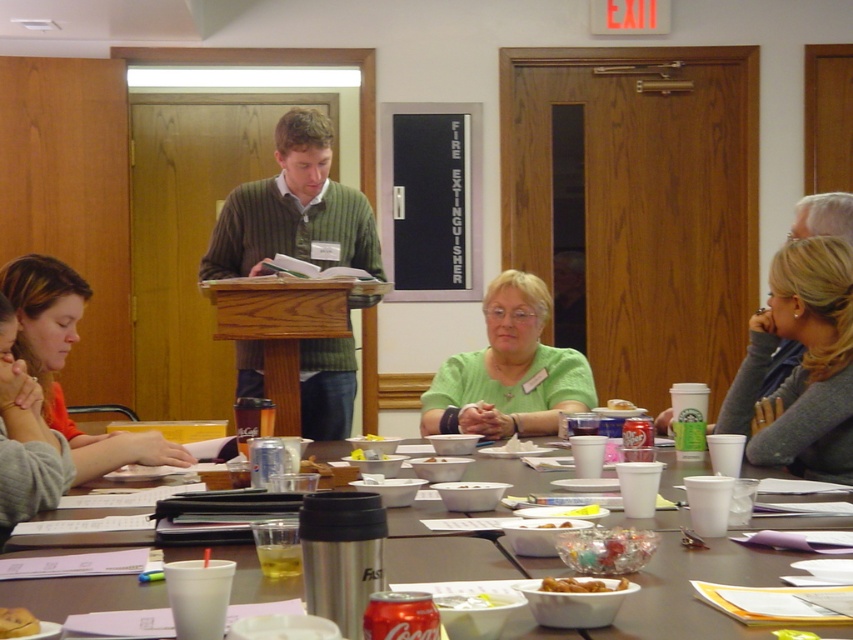
You are a guest at the meeting and want to grab a drink. You see a translucent plastic cup at center and a translucent plastic bowl at center on the table. Which one is on the right side?

The translucent plastic cup at center is positioned on the right side of the translucent plastic bowl at center.

You are a guest at the meeting and want to reach for the translucent plastic bowl at center without moving the translucent plastic cup at center. Is it possible to do so?

The translucent plastic bowl at center is behind the translucent plastic cup at center, so you can reach for the translucent plastic bowl at center by moving around the cup or from the back side without disturbing it.

You are a guest entering the conference room and need to place your coat on the nearest available surface. You see the wooden podium at center and the matte gray sweater at lower left. Which object is taller and can you place your coat on top of it?

The wooden podium at center is taller than the matte gray sweater at lower left. You can place your coat on the wooden podium at center since it has a greater height and likely provides a stable surface.